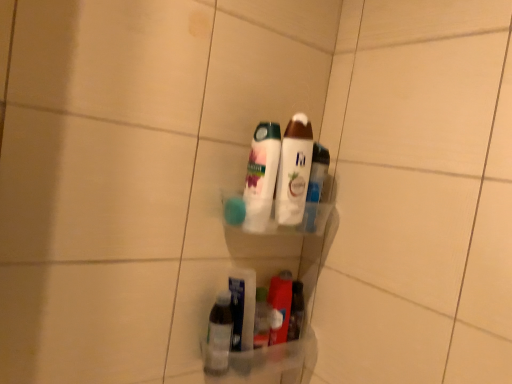
The image size is (512, 384). What do you see at coordinates (219, 335) in the screenshot?
I see `clear plastic bottle at lower center, which is counted as the 1th bottle, starting from the bottom` at bounding box center [219, 335].

Measure the distance between white glossy lotion at center, the third bottle positioned from the bottom, and camera.

33.37 inches.

This screenshot has height=384, width=512. Find the location of `white glossy lotion at center, the third bottle positioned from the bottom`. white glossy lotion at center, the third bottle positioned from the bottom is located at coordinates (294, 171).

Where is `clear plastic bottle at lower center, the 3th bottle positioned from the top`? This screenshot has height=384, width=512. clear plastic bottle at lower center, the 3th bottle positioned from the top is located at coordinates (219, 335).

Is translucent plastic bottles at center, positioned as the 2th bottle in bottom-to-top order, far away from white glossy lotion at center, the third bottle positioned from the bottom?

No, translucent plastic bottles at center, positioned as the 2th bottle in bottom-to-top order, is in close proximity to white glossy lotion at center, the third bottle positioned from the bottom.

Locate an element on the screen. Image resolution: width=512 pixels, height=384 pixels. bottle that is the 1st one when counting backward from the translucent plastic bottles at center, positioned as the 2th bottle in bottom-to-top order is located at coordinates (294, 171).

Is translucent plastic bottles at center, positioned as the 2th bottle in bottom-to-top order, facing away from white glossy lotion at center, the third bottle positioned from the bottom?

translucent plastic bottles at center, positioned as the 2th bottle in bottom-to-top order, is not turned away from white glossy lotion at center, the third bottle positioned from the bottom.

In terms of height, does white glossy lotion at center, which appears as the 1th bottle when viewed from the top, look taller or shorter compared to translucent plastic bottles at center, positioned as the 2th bottle in bottom-to-top order?

Clearly, white glossy lotion at center, which appears as the 1th bottle when viewed from the top, is taller compared to translucent plastic bottles at center, positioned as the 2th bottle in bottom-to-top order.

Is white glossy lotion at center, which appears as the 1th bottle when viewed from the top, not inside translucent plastic bottles at center, positioned as the second bottle in top-to-bottom order?

Yes, white glossy lotion at center, which appears as the 1th bottle when viewed from the top, is located beyond the bounds of translucent plastic bottles at center, positioned as the second bottle in top-to-bottom order.

Is white glossy lotion at center, which appears as the 1th bottle when viewed from the top, positioned with its back to translucent plastic bottles at center, positioned as the second bottle in top-to-bottom order?

No, white glossy lotion at center, which appears as the 1th bottle when viewed from the top,'s orientation is not away from translucent plastic bottles at center, positioned as the second bottle in top-to-bottom order.

Can you confirm if white glossy lotion at center, which appears as the 1th bottle when viewed from the top, is bigger than translucent plastic bottles at center, positioned as the 2th bottle in bottom-to-top order?

No, white glossy lotion at center, which appears as the 1th bottle when viewed from the top, is not bigger than translucent plastic bottles at center, positioned as the 2th bottle in bottom-to-top order.

Is clear plastic bottle at lower center, which is counted as the 1th bottle, starting from the bottom, further to camera compared to white glossy lotion at center, which appears as the 1th bottle when viewed from the top?

Yes, clear plastic bottle at lower center, which is counted as the 1th bottle, starting from the bottom, is further from the viewer.

Can you tell me how much clear plastic bottle at lower center, which is counted as the 1th bottle, starting from the bottom, and white glossy lotion at center, the third bottle positioned from the bottom, differ in facing direction?

There is a 0.00247-degree angle between the facing directions of clear plastic bottle at lower center, which is counted as the 1th bottle, starting from the bottom, and white glossy lotion at center, the third bottle positioned from the bottom.

In terms of size, does clear plastic bottle at lower center, the 3th bottle positioned from the top, appear bigger or smaller than white glossy lotion at center, the third bottle positioned from the bottom?

clear plastic bottle at lower center, the 3th bottle positioned from the top, is smaller than white glossy lotion at center, the third bottle positioned from the bottom.

Does translucent plastic bottles at center, positioned as the 2th bottle in bottom-to-top order, have a smaller size compared to clear plastic bottle at lower center, which is counted as the 1th bottle, starting from the bottom?

No, translucent plastic bottles at center, positioned as the 2th bottle in bottom-to-top order, is not smaller than clear plastic bottle at lower center, which is counted as the 1th bottle, starting from the bottom.

From the image's perspective, does translucent plastic bottles at center, positioned as the second bottle in top-to-bottom order, appear higher than clear plastic bottle at lower center, the 3th bottle positioned from the top?

Yes.

Is point (262, 188) farther from camera compared to point (221, 332)?

No, it is in front of (221, 332).

Is translucent plastic bottles at center, positioned as the 2th bottle in bottom-to-top order, oriented away from clear plastic bottle at lower center, which is counted as the 1th bottle, starting from the bottom?

No, translucent plastic bottles at center, positioned as the 2th bottle in bottom-to-top order, is not facing the opposite direction of clear plastic bottle at lower center, which is counted as the 1th bottle, starting from the bottom.

From the picture: Considering the relative positions of clear plastic bottle at lower center, which is counted as the 1th bottle, starting from the bottom, and translucent plastic bottles at center, positioned as the second bottle in top-to-bottom order, in the image provided, is clear plastic bottle at lower center, which is counted as the 1th bottle, starting from the bottom, in front of translucent plastic bottles at center, positioned as the second bottle in top-to-bottom order,?

No, it is behind translucent plastic bottles at center, positioned as the second bottle in top-to-bottom order.

Measure the distance between clear plastic bottle at lower center, which is counted as the 1th bottle, starting from the bottom, and translucent plastic bottles at center, positioned as the 2th bottle in bottom-to-top order.

The distance of clear plastic bottle at lower center, which is counted as the 1th bottle, starting from the bottom, from translucent plastic bottles at center, positioned as the 2th bottle in bottom-to-top order, is 9.66 inches.

Between clear plastic bottle at lower center, which is counted as the 1th bottle, starting from the bottom, and translucent plastic bottles at center, positioned as the second bottle in top-to-bottom order, which one appears on the left side from the viewer's perspective?

Positioned to the left is clear plastic bottle at lower center, which is counted as the 1th bottle, starting from the bottom.

Considering the positions of point (289, 183) and point (208, 351), is point (289, 183) closer or farther from the camera than point (208, 351)?

Point (289, 183) is closer to the camera than point (208, 351).

Which of these two, white glossy lotion at center, which appears as the 1th bottle when viewed from the top, or clear plastic bottle at lower center, the 3th bottle positioned from the top, is bigger?

With larger size is white glossy lotion at center, which appears as the 1th bottle when viewed from the top.

Can you confirm if white glossy lotion at center, the third bottle positioned from the bottom, is positioned to the right of clear plastic bottle at lower center, which is counted as the 1th bottle, starting from the bottom?

Correct, you'll find white glossy lotion at center, the third bottle positioned from the bottom, to the right of clear plastic bottle at lower center, which is counted as the 1th bottle, starting from the bottom.

From the image's perspective, is white glossy lotion at center, which appears as the 1th bottle when viewed from the top, above or below clear plastic bottle at lower center, which is counted as the 1th bottle, starting from the bottom?

white glossy lotion at center, which appears as the 1th bottle when viewed from the top, is situated higher than clear plastic bottle at lower center, which is counted as the 1th bottle, starting from the bottom, in the image.

The height and width of the screenshot is (384, 512). Identify the location of bottle above the translucent plastic bottles at center, positioned as the 2th bottle in bottom-to-top order (from the image's perspective). (294, 171).

From the translucent plastic bottles at center, positioned as the 2th bottle in bottom-to-top order, count 1st bottles backward and point to it. Please provide its 2D coordinates.

[(294, 171)]

Looking at the image, which one is located closer to white glossy lotion at center, which appears as the 1th bottle when viewed from the top, clear plastic bottle at lower center, which is counted as the 1th bottle, starting from the bottom, or translucent plastic bottles at center, positioned as the second bottle in top-to-bottom order?

Based on the image, translucent plastic bottles at center, positioned as the second bottle in top-to-bottom order, appears to be nearer to white glossy lotion at center, which appears as the 1th bottle when viewed from the top.

Looking at this image, which object lies further to the anchor point clear plastic bottle at lower center, which is counted as the 1th bottle, starting from the bottom, white glossy lotion at center, which appears as the 1th bottle when viewed from the top, or translucent plastic bottles at center, positioned as the 2th bottle in bottom-to-top order?

The object further to clear plastic bottle at lower center, which is counted as the 1th bottle, starting from the bottom, is white glossy lotion at center, which appears as the 1th bottle when viewed from the top.

When comparing their distances from clear plastic bottle at lower center, the 3th bottle positioned from the top, does translucent plastic bottles at center, positioned as the 2th bottle in bottom-to-top order, or white glossy lotion at center, the third bottle positioned from the bottom, seem further?

The object further to clear plastic bottle at lower center, the 3th bottle positioned from the top, is white glossy lotion at center, the third bottle positioned from the bottom.

Considering their positions, is clear plastic bottle at lower center, which is counted as the 1th bottle, starting from the bottom, positioned further to translucent plastic bottles at center, positioned as the second bottle in top-to-bottom order, than white glossy lotion at center, the third bottle positioned from the bottom?

clear plastic bottle at lower center, which is counted as the 1th bottle, starting from the bottom.

When comparing their distances from white glossy lotion at center, the third bottle positioned from the bottom, does translucent plastic bottles at center, positioned as the 2th bottle in bottom-to-top order, or clear plastic bottle at lower center, which is counted as the 1th bottle, starting from the bottom, seem closer?

Based on the image, translucent plastic bottles at center, positioned as the 2th bottle in bottom-to-top order, appears to be nearer to white glossy lotion at center, the third bottle positioned from the bottom.

Based on the photo, from the image, which object appears to be nearer to translucent plastic bottles at center, positioned as the second bottle in top-to-bottom order, white glossy lotion at center, which appears as the 1th bottle when viewed from the top, or clear plastic bottle at lower center, which is counted as the 1th bottle, starting from the bottom?

Among the two, white glossy lotion at center, which appears as the 1th bottle when viewed from the top, is located nearer to translucent plastic bottles at center, positioned as the second bottle in top-to-bottom order.

Identify the location of bottle between white glossy lotion at center, the third bottle positioned from the bottom, and clear plastic bottle at lower center, which is counted as the 1th bottle, starting from the bottom, vertically. (261, 176).